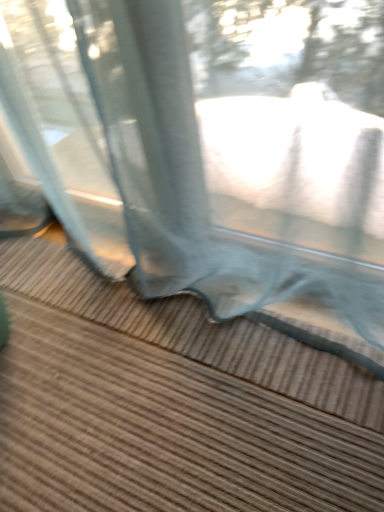
Image resolution: width=384 pixels, height=512 pixels. Describe the element at coordinates (194, 332) in the screenshot. I see `brown corduroy doormat at center` at that location.

You are a GUI agent. You are given a task and a screenshot of the screen. Output one action in this format:
    pyautogui.click(x=<x>, y=<y>)
    Task: Click on the brown corduroy doormat at center
    This screenshot has width=384, height=512.
    Given the screenshot: What is the action you would take?
    pyautogui.click(x=194, y=332)

Identify the location of brown corduroy doormat at center. (194, 332).